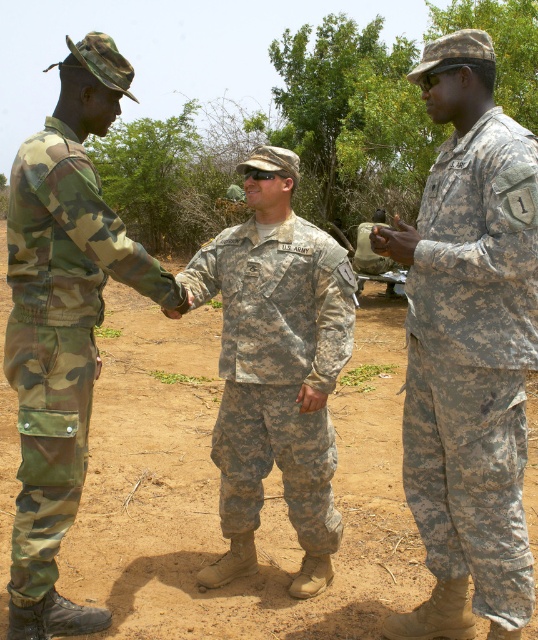
Does camouflage fabric uniform at right have a larger size compared to camo fabric uniform at left?

Actually, camouflage fabric uniform at right might be smaller than camo fabric uniform at left.

Is point (518, 387) positioned after point (80, 269)?

No, it is in front of (80, 269).

Find the location of a particular element. camouflage fabric uniform at right is located at coordinates (473, 362).

Between dirt field at center and camouflage fabric uniform at center, which one has more height?

With more height is dirt field at center.

Is point (116, 330) closer to viewer compared to point (286, 444)?

That is False.

I want to click on dirt field at center, so click(x=218, y=484).

Between dirt field at center and camouflage fabric uniform at right, which one has more height?

With more height is dirt field at center.

Is dirt field at center to the right of camouflage fabric uniform at right from the viewer's perspective?

Incorrect, dirt field at center is not on the right side of camouflage fabric uniform at right.

The height and width of the screenshot is (640, 538). What are the coordinates of `dirt field at center` in the screenshot? It's located at (218, 484).